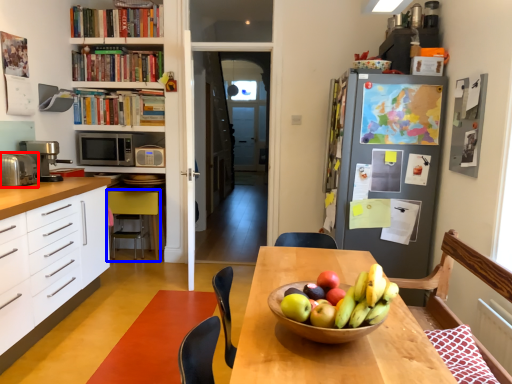
Question: Which object appears farthest to the camera in this image, appliance (highlighted by a red box) or chair (highlighted by a blue box)?

Choices:
 (A) appliance
 (B) chair

Answer: (B)